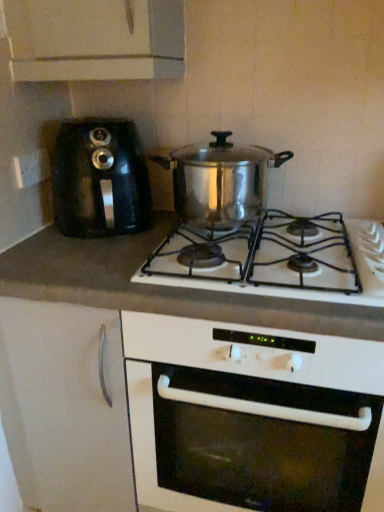
Question: Is point (208, 205) positioned closer to the camera than point (187, 261)?

Choices:
 (A) closer
 (B) farther

Answer: (B)

Question: From a real-world perspective, is shiny metallic pot at center physically located above or below shiny metallic pot at center?

Choices:
 (A) above
 (B) below

Answer: (A)

Question: Which of these objects is positioned closest to the black plastic coffee machine at left?

Choices:
 (A) shiny metallic pot at center
 (B) shiny metallic pot at center
 (C) white matte gas stove at center
 (D) white matte cabinet at lower left
 (E) white plastic socket at left

Answer: (E)

Question: Based on their relative distances, which object is nearer to the shiny metallic pot at center?

Choices:
 (A) white matte gas stove at center
 (B) shiny metallic pot at center
 (C) white matte cabinet at lower left
 (D) white plastic socket at left
 (E) black plastic coffee machine at left

Answer: (B)